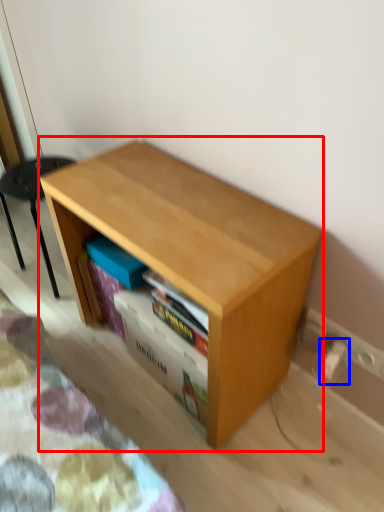
Question: Which point is closer to the camera, table (highlighted by a red box) or electric outlet (highlighted by a blue box)?

Choices:
 (A) table
 (B) electric outlet

Answer: (A)